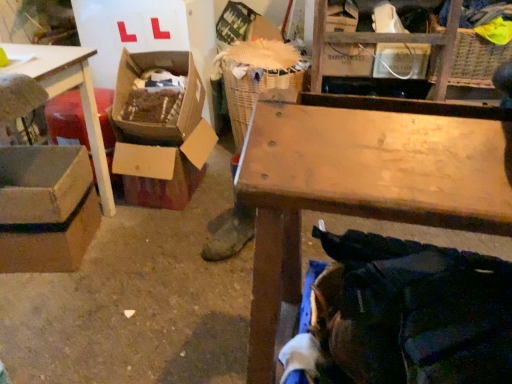
Question: From a real-world perspective, is woven straw laundry basket at center physically located above or below gray cardboard box at lower left, the first box in the left-to-right sequence?

Choices:
 (A) below
 (B) above

Answer: (B)

Question: Relative to gray cardboard box at lower left, which is counted as the 2th box, starting from the right, is woven straw laundry basket at center in front or behind?

Choices:
 (A) behind
 (B) front

Answer: (A)

Question: Considering the real-world distances, which object is farthest from the wooden table at center?

Choices:
 (A) gray cardboard box at lower left, which is counted as the 2th box, starting from the right
 (B) wooden crate at upper center
 (C) woven straw laundry basket at center
 (D) cardboard box at center-left, marked as the 1th box in a right-to-left arrangement
 (E) cardboard box at left

Answer: (B)

Question: Considering the real-world distances, which object is farthest from the cardboard box at left?

Choices:
 (A) wooden crate at upper center
 (B) cardboard box at center-left, the 2th box when ordered from left to right
 (C) wooden table at center
 (D) woven straw laundry basket at center
 (E) gray cardboard box at lower left, the first box in the left-to-right sequence

Answer: (C)